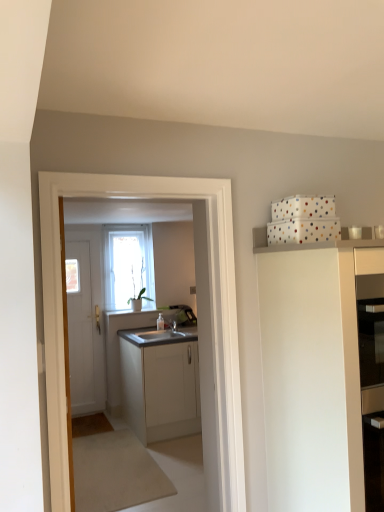
Question: Is white matte cabinet at center, the second cabinetry in the right-to-left sequence, further to camera compared to transparent glass window at center?

Choices:
 (A) no
 (B) yes

Answer: (A)

Question: Is white matte cabinet at center, the second cabinetry in the right-to-left sequence, outside of transparent glass window at center?

Choices:
 (A) no
 (B) yes

Answer: (B)

Question: From a real-world perspective, is white matte cabinet at center, which ranks as the first cabinetry in back-to-front order, on transparent glass window at center?

Choices:
 (A) yes
 (B) no

Answer: (B)

Question: Can you confirm if white matte cabinet at center, the second cabinetry in the right-to-left sequence, is bigger than transparent glass window at center?

Choices:
 (A) yes
 (B) no

Answer: (A)

Question: Does white matte cabinet at center, which ranks as the first cabinetry in back-to-front order, come in front of transparent glass window at center?

Choices:
 (A) no
 (B) yes

Answer: (B)

Question: Can you confirm if white matte cabinet at center, the second cabinetry from the front, is thinner than transparent glass window at center?

Choices:
 (A) yes
 (B) no

Answer: (B)

Question: From a real-world perspective, is white matte door at left below white matte cabinet at center, the second cabinetry from the front?

Choices:
 (A) no
 (B) yes

Answer: (A)

Question: Would you say white matte door at left is a long distance from white matte cabinet at center, which ranks as the first cabinetry in back-to-front order?

Choices:
 (A) yes
 (B) no

Answer: (B)

Question: Is white matte door at left aimed at white matte cabinet at center, the second cabinetry in the right-to-left sequence?

Choices:
 (A) yes
 (B) no

Answer: (B)

Question: From a real-world perspective, is white matte door at left on white matte cabinet at center, which is the 1th cabinetry in left-to-right order?

Choices:
 (A) no
 (B) yes

Answer: (B)

Question: Is white matte cabinet at center, which is the 1th cabinetry in left-to-right order, inside white matte door at left?

Choices:
 (A) yes
 (B) no

Answer: (B)

Question: Is white matte door at left closer to camera compared to white matte cabinet at center, the second cabinetry in the right-to-left sequence?

Choices:
 (A) no
 (B) yes

Answer: (A)

Question: Is white matte cabinet at upper right, the 1th cabinetry in the front-to-back sequence, oriented away from white matte door at left?

Choices:
 (A) no
 (B) yes

Answer: (B)